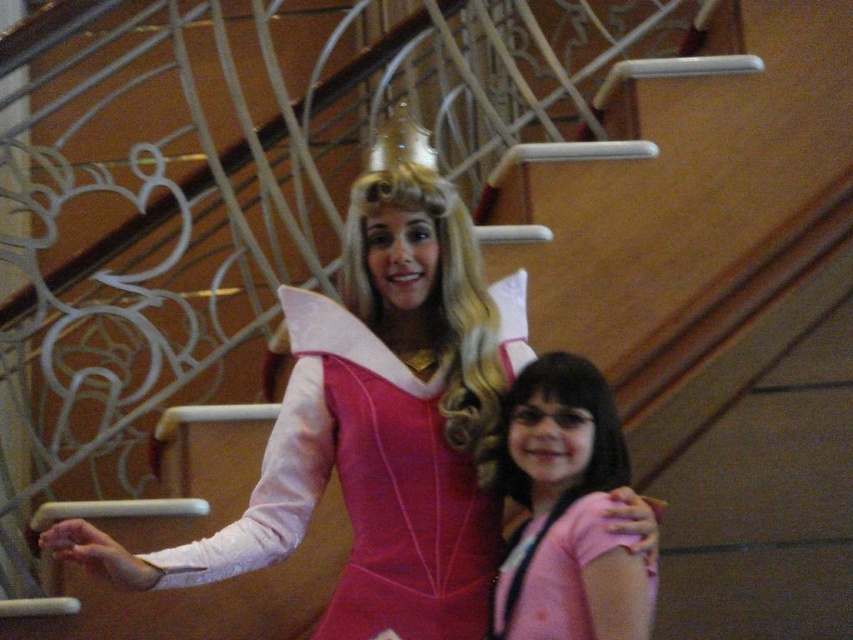
You are organizing a photoshoot and need to ensure that the satin pink dress at center and the pink fabric at center are positioned correctly. Based on the scene description, which object occupies more horizontal space in the image?

The satin pink dress at center is wider than the pink fabric at center, so it occupies more horizontal space in the image.

You are a photographer standing at the camera position. You want to adjust the focus to capture the satin pink dress at center clearly. What is the required focusing distance in meters?

The satin pink dress at center is 5.10 meters away from the camera, so the required focusing distance is 5.10 meters.

You are a photographer setting up for a photoshoot in a room with a staircase and decorative railings. You notice two pink items in the scene described as the satin pink dress at center and the pink fabric at center. Which of these two items is located to the left of the other?

The satin pink dress at center is positioned on the left side of the pink fabric at center.